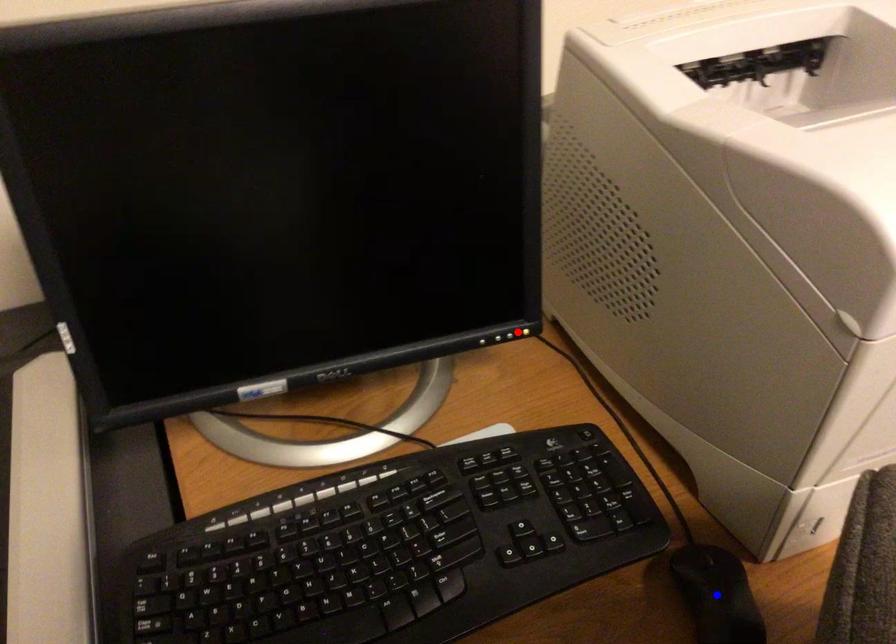
Question: Two points are marked on the image. Which point is closer to the camera?

Choices:
 (A) Blue point is closer.
 (B) Red point is closer.

Answer: (A)